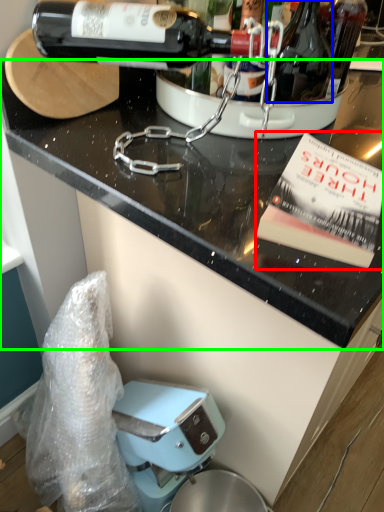
Question: Estimate the real-world distances between objects in this image. Which object is farther from paperback book (highlighted by a red box), bottle (highlighted by a blue box) or countertop (highlighted by a green box)?

Choices:
 (A) bottle
 (B) countertop

Answer: (A)